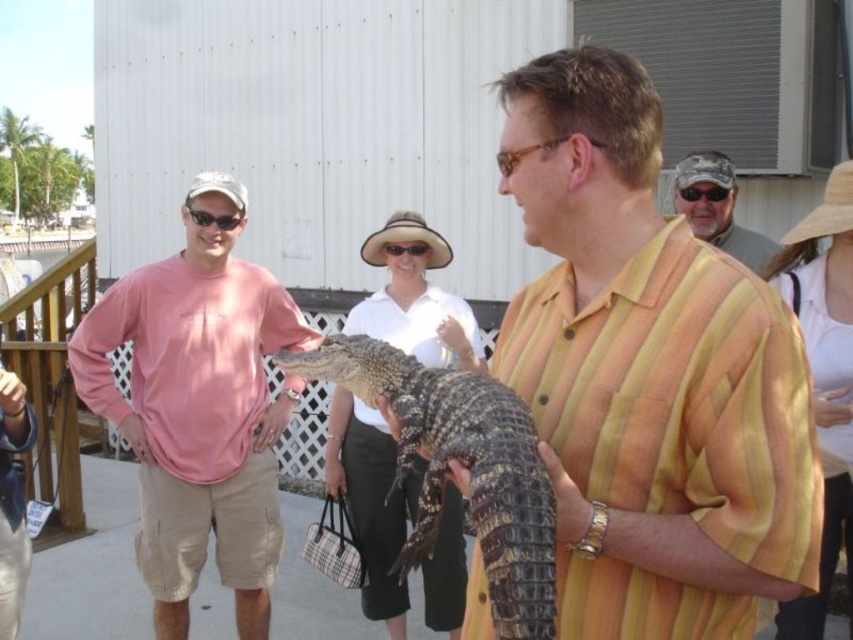
Question: Among these points, which one is farthest from the camera?

Choices:
 (A) (198, 390)
 (B) (520, 316)
 (C) (421, 548)
 (D) (741, 230)

Answer: (D)

Question: Observing the image, what is the correct spatial positioning of pink long-sleeve shirt at left in reference to matte khaki shorts at right?

Choices:
 (A) below
 (B) above

Answer: (A)

Question: Can you confirm if pink long-sleeve shirt at left is positioned below scaly brown alligator at center?

Choices:
 (A) yes
 (B) no

Answer: (A)

Question: Which point appears farthest from the camera in this image?

Choices:
 (A) (534, 563)
 (B) (683, 198)
 (C) (787, 435)

Answer: (B)

Question: Which point is farther from the camera taking this photo?

Choices:
 (A) (727, 180)
 (B) (303, 365)

Answer: (A)

Question: In this image, where is pink long-sleeve shirt at left located relative to scaly brown alligator at center?

Choices:
 (A) above
 (B) below

Answer: (B)